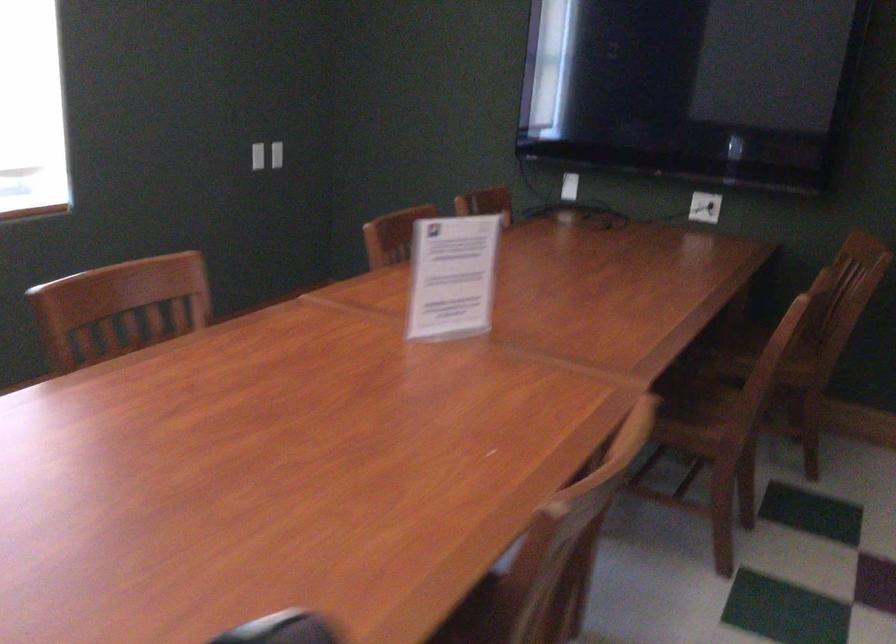
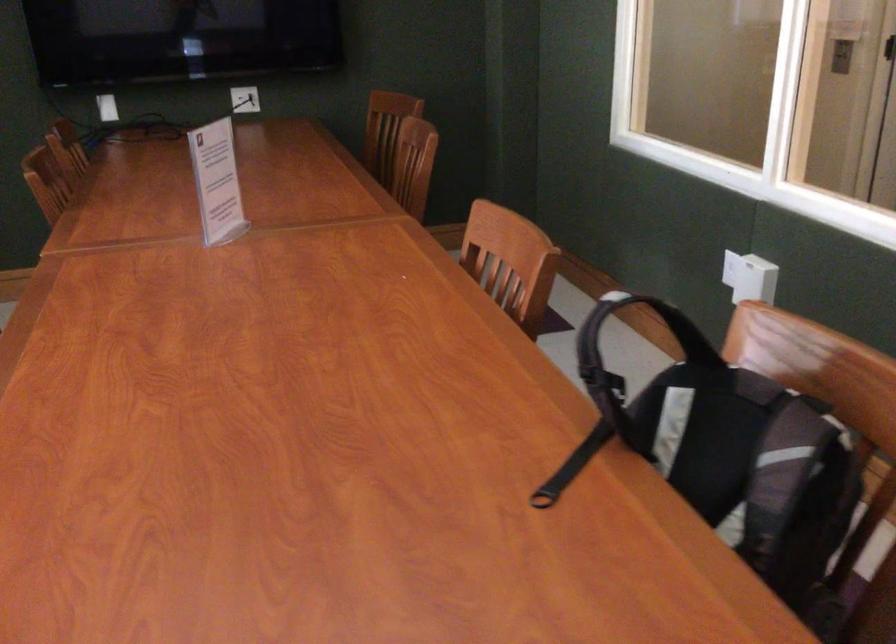
Locate, in the second image, the point that corresponds to (693,207) in the first image.

(245, 99)